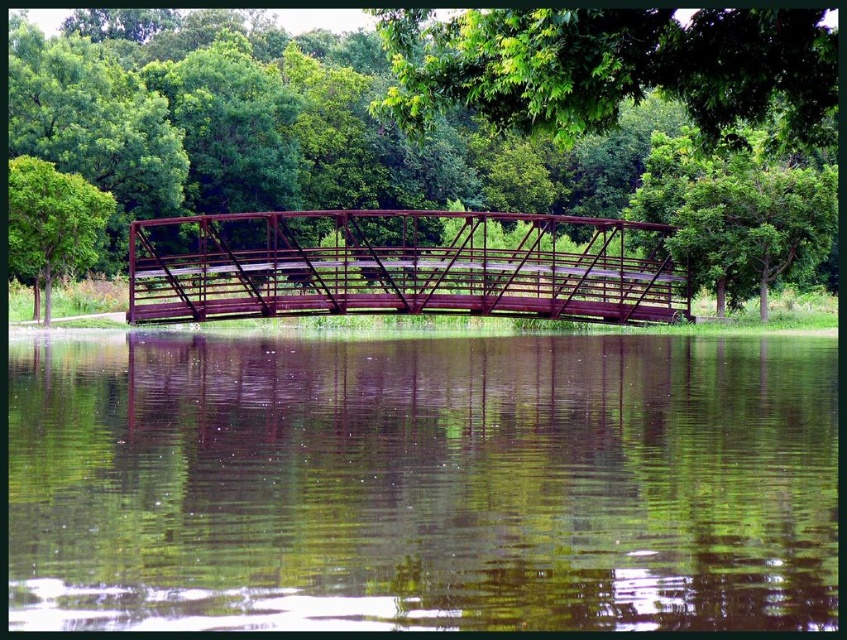
Question: Among these objects, which one is farthest from the camera?

Choices:
 (A) rustic metal bridge at center
 (B) green reflective water at center
 (C) green leafy tree at center

Answer: (A)

Question: Observing the image, what is the correct spatial positioning of green reflective water at center in reference to green leafy tree at upper center?

Choices:
 (A) above
 (B) below

Answer: (B)

Question: Can you confirm if green leafy tree at upper center is bigger than green leafy tree at left?

Choices:
 (A) no
 (B) yes

Answer: (B)

Question: Which point is closer to the camera taking this photo?

Choices:
 (A) (491, 384)
 (B) (446, 275)

Answer: (A)

Question: Which point is closer to the camera?

Choices:
 (A) (281, 428)
 (B) (186, 209)

Answer: (A)

Question: Does green leafy tree at center appear on the left side of green leafy tree at upper center?

Choices:
 (A) no
 (B) yes

Answer: (B)